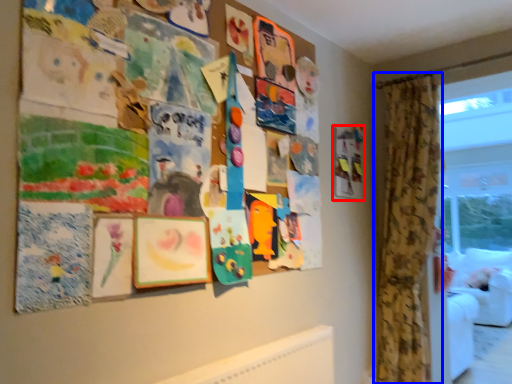
Question: Among these objects, which one is nearest to the camera, picture frame (highlighted by a red box) or curtain (highlighted by a blue box)?

Choices:
 (A) picture frame
 (B) curtain

Answer: (B)